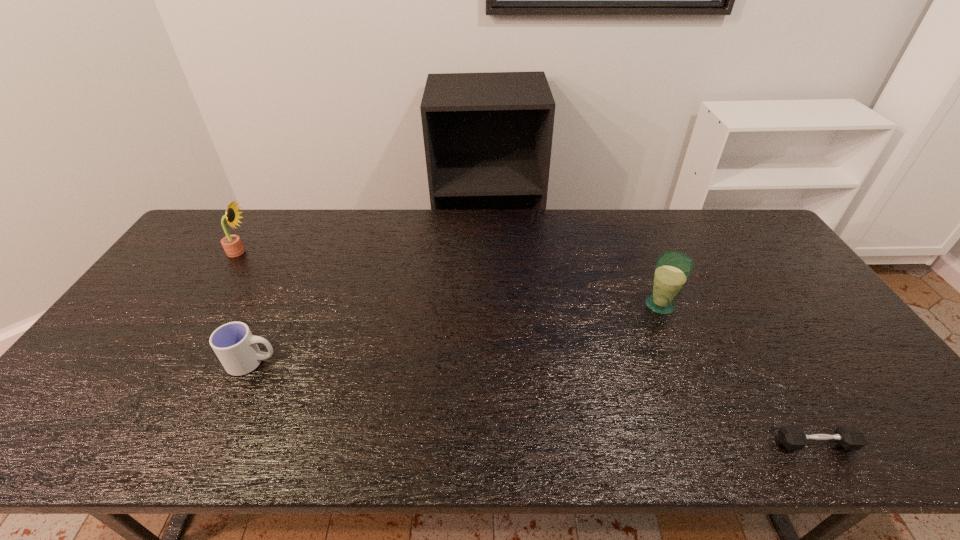
Identify which object is the second closest to the second shortest object. Please provide its 2D coordinates. Your answer should be formatted as a tuple, i.e. [(x, y)], where the tuple contains the x and y coordinates of a point satisfying the conditions above.

[(672, 270)]

Locate an element on the screen. the second closest object to the cup is located at coordinates (672, 270).

The height and width of the screenshot is (540, 960). What are the coordinates of `vacant position in the image that satisfies the following two spatial constraints: 1. with the handle on the side of the third object from right to left; 2. on the right side of the rightmost object` in the screenshot? It's located at (214, 443).

You are a GUI agent. You are given a task and a screenshot of the screen. Output one action in this format:
    pyautogui.click(x=<x>, y=<y>)
    Task: Click on the vacant point that satisfies the following two spatial constraints: 1. on the face of the nearest object; 2. on the right side of the sunflower
    The height and width of the screenshot is (540, 960).
    Given the screenshot: What is the action you would take?
    pyautogui.click(x=116, y=443)

At what (x,y) coordinates should I click in order to perform the action: click on vacant space that satisfies the following two spatial constraints: 1. on the face of the leftmost object; 2. on the left side of the second object from right to left. Please return your answer as a coordinate pair (x, y). This screenshot has width=960, height=540. Looking at the image, I should click on (205, 305).

You are a GUI agent. You are given a task and a screenshot of the screen. Output one action in this format:
    pyautogui.click(x=<x>, y=<y>)
    Task: Click on the free spot that satisfies the following two spatial constraints: 1. with the handle on the side of the shortest object; 2. on the left side of the cup
    
    Given the screenshot: What is the action you would take?
    pyautogui.click(x=214, y=443)

Find the location of a particular element. This screenshot has width=960, height=540. free point that satisfies the following two spatial constraints: 1. on the face of the third object from left to right; 2. on the left side of the sunflower is located at coordinates (205, 305).

Locate an element on the screen. The width and height of the screenshot is (960, 540). free point that satisfies the following two spatial constraints: 1. with the handle on the side of the cup; 2. on the right side of the shortest object is located at coordinates (214, 443).

You are a GUI agent. You are given a task and a screenshot of the screen. Output one action in this format:
    pyautogui.click(x=<x>, y=<y>)
    Task: Click on the vacant point that satisfies the following two spatial constraints: 1. on the face of the sunflower; 2. on the back side of the second tallest object
    This screenshot has height=540, width=960.
    Given the screenshot: What is the action you would take?
    pyautogui.click(x=205, y=305)

At what (x,y) coordinates should I click in order to perform the action: click on free spot that satisfies the following two spatial constraints: 1. on the back side of the rightmost object; 2. with the handle on the side of the third tallest object. Please return your answer as a coordinate pair (x, y). Looking at the image, I should click on click(768, 362).